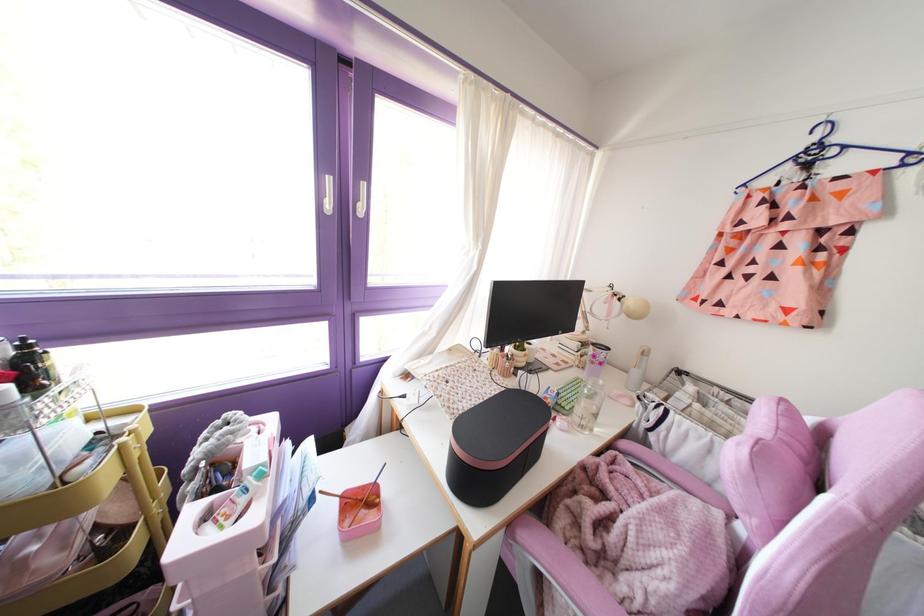
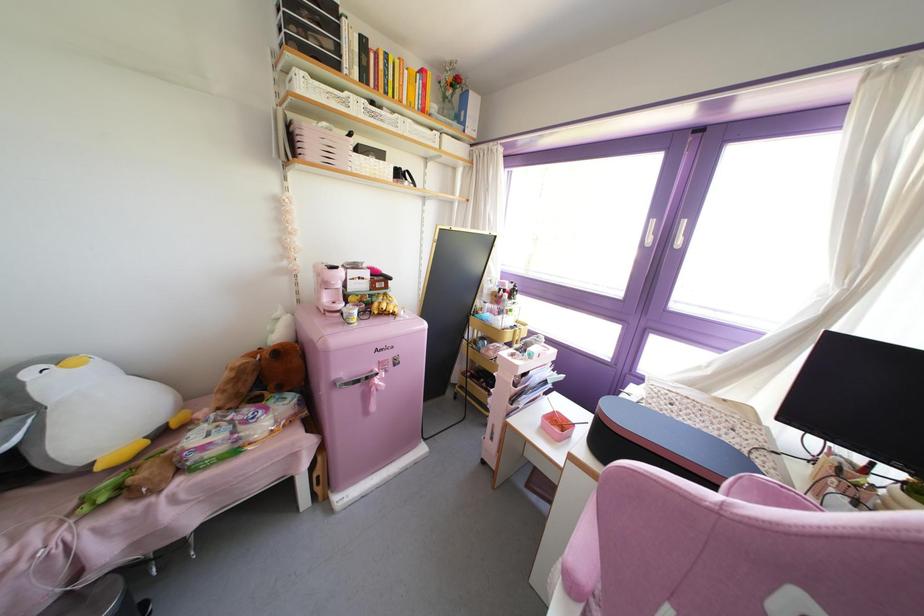
Locate, in the second image, the point that corresponds to (x=359, y=487) in the first image.

(565, 418)